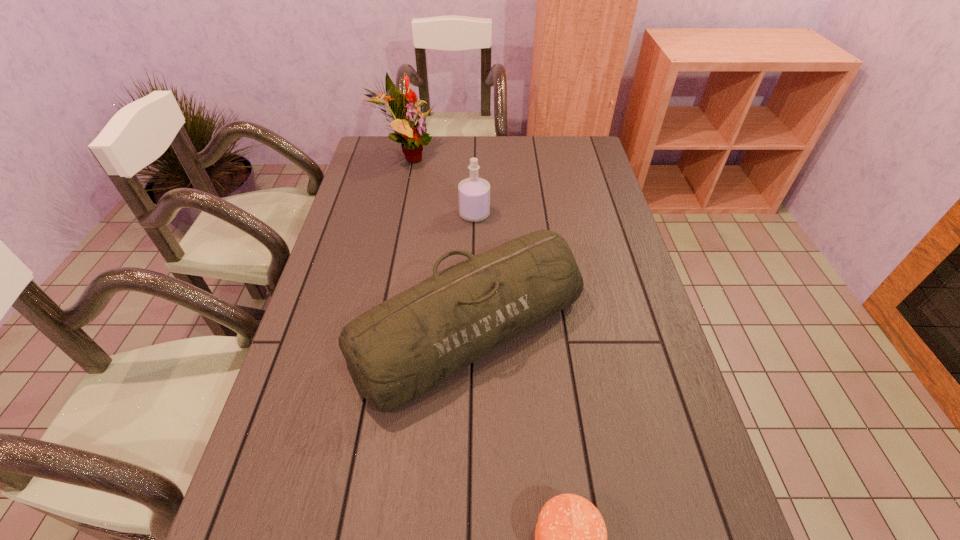
Find the location of a particular element. This screenshot has height=540, width=960. the tallest object is located at coordinates (414, 137).

Find the location of `the farthest object`. the farthest object is located at coordinates (414, 137).

Where is `the third nearest object`? the third nearest object is located at coordinates (474, 193).

In order to click on the second nearest object in this screenshot , I will do `click(403, 347)`.

Where is `vacant space situated 0.210m on the front-facing side of the bouquet`? Image resolution: width=960 pixels, height=540 pixels. vacant space situated 0.210m on the front-facing side of the bouquet is located at coordinates (493, 157).

Find the location of a particular element. The image size is (960, 540). blank area located on the back of the perfume is located at coordinates [475, 186].

Identify the location of free location located 0.160m on the front of the third farthest object. This screenshot has height=540, width=960. (465, 501).

Locate an element on the screen. object at the far edge is located at coordinates (414, 137).

This screenshot has width=960, height=540. Identify the location of bouquet situated at the left edge. (414, 137).

Locate an element on the screen. The height and width of the screenshot is (540, 960). duffel bag at the left edge is located at coordinates (403, 347).